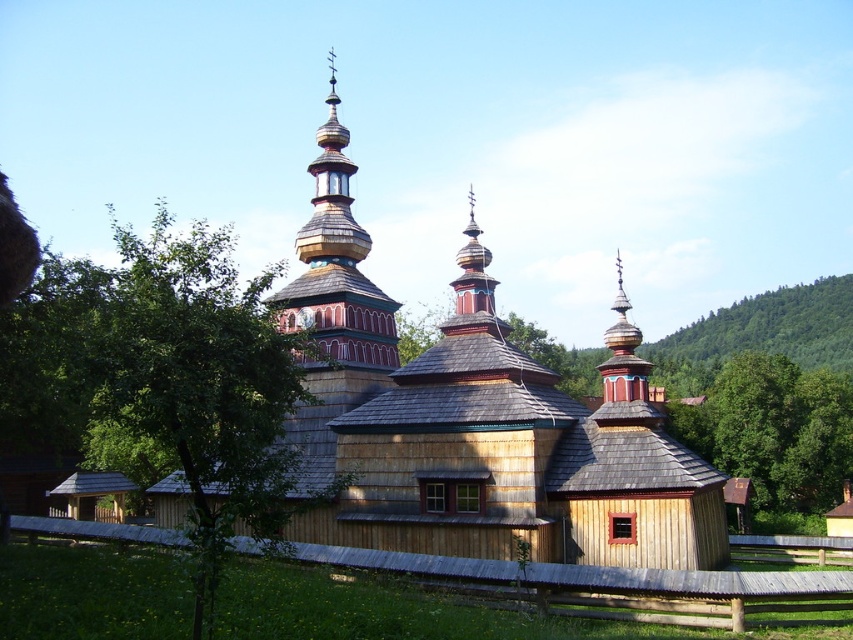
Question: Estimate the real-world distances between objects in this image. Which object is closer to the wooden church at center?

Choices:
 (A) green leafy tree at right
 (B) painted wood tower at upper center

Answer: (B)

Question: Which object appears farthest from the camera in this image?

Choices:
 (A) painted wood tower at upper center
 (B) green leafy tree at right
 (C) wooden church at center

Answer: (B)

Question: Among these points, which one is nearest to the camera?

Choices:
 (A) (314, 296)
 (B) (738, 356)

Answer: (A)

Question: Can you confirm if wooden church at center is smaller than painted wood tower at upper center?

Choices:
 (A) no
 (B) yes

Answer: (A)

Question: Does wooden church at center have a smaller size compared to green leafy tree at right?

Choices:
 (A) yes
 (B) no

Answer: (B)

Question: Does wooden church at center appear under green leafy tree at right?

Choices:
 (A) no
 (B) yes

Answer: (A)